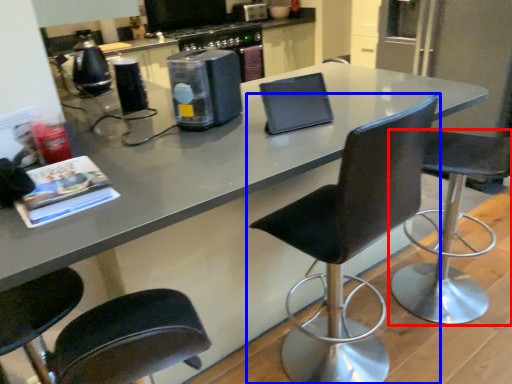
Question: Which object is closer to the camera taking this photo, chair (highlighted by a red box) or chair (highlighted by a blue box)?

Choices:
 (A) chair
 (B) chair

Answer: (B)